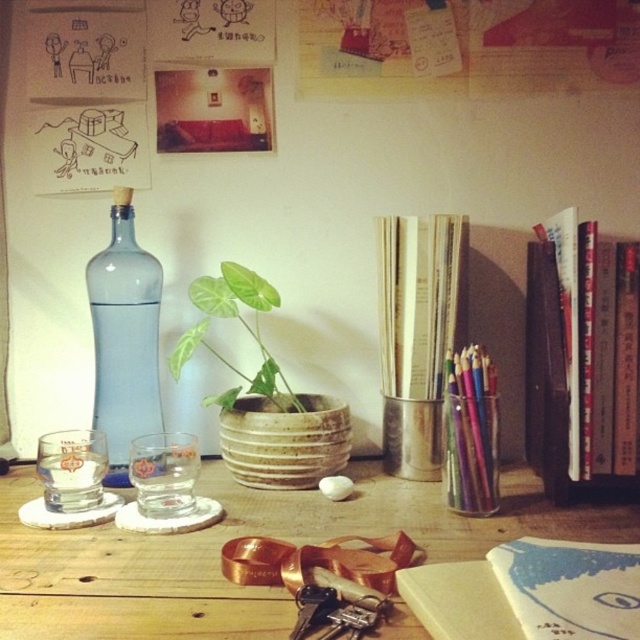
Question: Is wooden table at center below transparent glass bottle at left?

Choices:
 (A) yes
 (B) no

Answer: (A)

Question: Which object appears closest to the camera in this image?

Choices:
 (A) green matte plant at center
 (B) transparent glass at lower left
 (C) transparent glass bottle at left
 (D) hardcover books at right

Answer: (D)

Question: Which point appears closest to the camera in this image?

Choices:
 (A) (192, 328)
 (B) (129, 228)

Answer: (B)

Question: Does wooden table at center appear under hardcover books at right?

Choices:
 (A) no
 (B) yes

Answer: (B)

Question: Which object appears closest to the camera in this image?

Choices:
 (A) transparent glass at lower left
 (B) hardcover book at center
 (C) green matte plant at center
 (D) wooden table at center

Answer: (B)

Question: Does wooden table at center appear under transparent glass bottle at left?

Choices:
 (A) no
 (B) yes

Answer: (B)